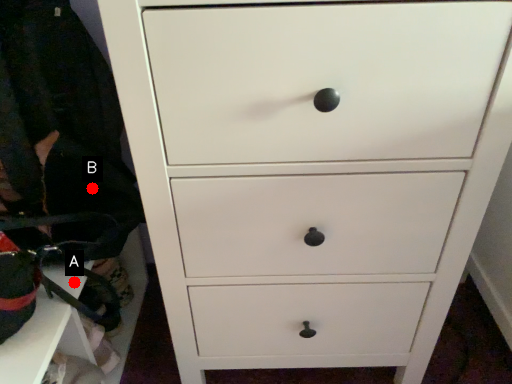
Question: Two points are circled on the image, labeled by A and B beside each circle. Which of the following is the closest to the observer?

Choices:
 (A) A is closer
 (B) B is closer

Answer: (A)